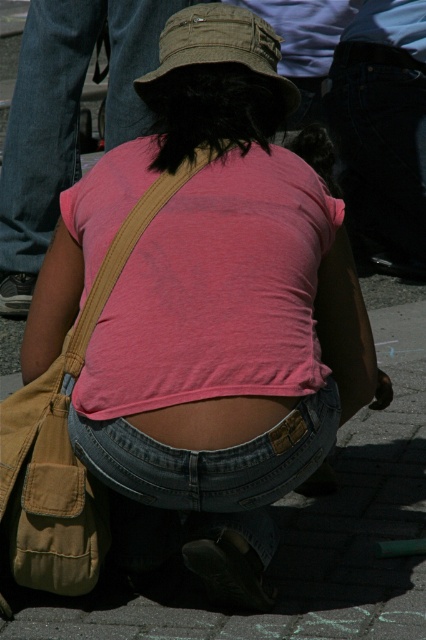
The height and width of the screenshot is (640, 426). What do you see at coordinates (304, 531) in the screenshot?
I see `paved stone pavement at center` at bounding box center [304, 531].

Who is more distant from viewer, (203, 602) or (276, 417)?

Point (203, 602)

Is point (420, 436) farther from viewer compared to point (226, 419)?

Yes, it is behind point (226, 419).

Find the location of a particular element. paved stone pavement at center is located at coordinates (304, 531).

Which is behind, point (19, 419) or point (219, 16)?

Positioned behind is point (219, 16).

Can you confirm if khaki canvas bag at lower left is shorter than khaki fabric hat at center?

In fact, khaki canvas bag at lower left may be taller than khaki fabric hat at center.

In order to click on khaki canvas bag at lower left in this screenshot , I will do [x=49, y=486].

Locate an element on the screen. khaki canvas bag at lower left is located at coordinates tap(49, 486).

Does paved stone pavement at center have a lesser width compared to jeans at center?

No, paved stone pavement at center is not thinner than jeans at center.

Who is shorter, paved stone pavement at center or jeans at center?

With less height is paved stone pavement at center.

Describe the element at coordinates (304, 531) in the screenshot. I see `paved stone pavement at center` at that location.

Identify the location of paved stone pavement at center. (304, 531).